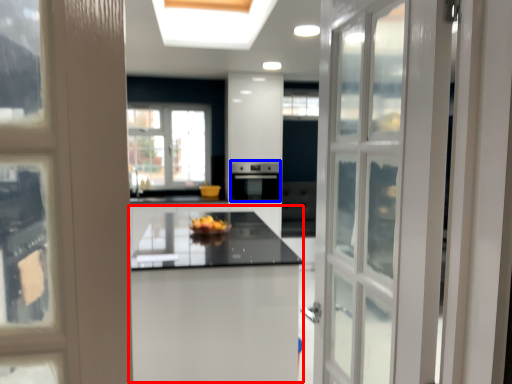
Question: Which object is further to the camera taking this photo, table (highlighted by a red box) or appliance (highlighted by a blue box)?

Choices:
 (A) table
 (B) appliance

Answer: (B)